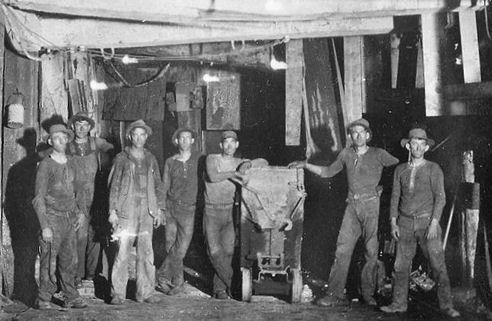
The width and height of the screenshot is (492, 321). I want to click on wood doorway, so click(184, 84).